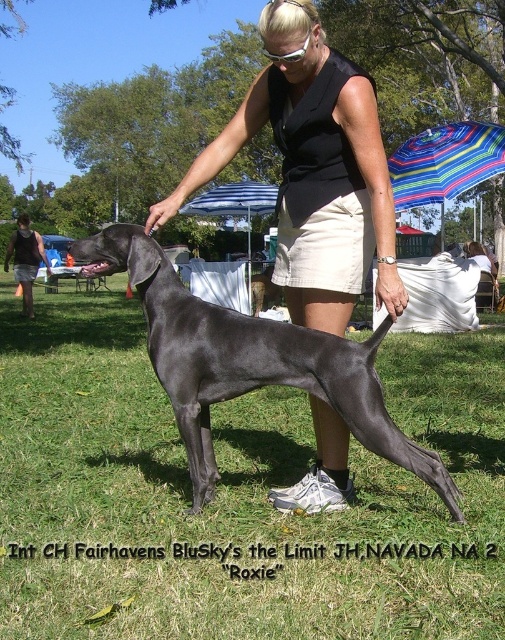
Is point (152, 452) positioned behind point (224, 314)?

That is True.

Image resolution: width=505 pixels, height=640 pixels. Describe the element at coordinates (234, 493) in the screenshot. I see `green grass at center` at that location.

Measure the distance between green grass at center and camera.

green grass at center and camera are 7.32 feet apart from each other.

This screenshot has height=640, width=505. In order to click on green grass at center in this screenshot , I will do `click(234, 493)`.

Can you confirm if green grass at center is positioned to the right of black matte skirt at center?

Indeed, green grass at center is positioned on the right side of black matte skirt at center.

In the scene shown: Who is more forward, (12, 417) or (147, 228)?

Point (147, 228) is in front.

Find the location of a particular element. The width and height of the screenshot is (505, 640). green grass at center is located at coordinates (234, 493).

Identify the location of green grass at center. The image size is (505, 640). (234, 493).

Does black matte skirt at center have a smaller size compared to shiny black dog at center?

Actually, black matte skirt at center might be larger than shiny black dog at center.

Who is higher up, black matte skirt at center or shiny black dog at center?

Positioned higher is black matte skirt at center.

Is point (191, 176) in front of point (157, 243)?

Yes.

At what (x,y) coordinates should I click in order to perform the action: click on black matte skirt at center. Please return your answer as a coordinate pair (x, y). This screenshot has height=640, width=505. Looking at the image, I should click on (314, 170).